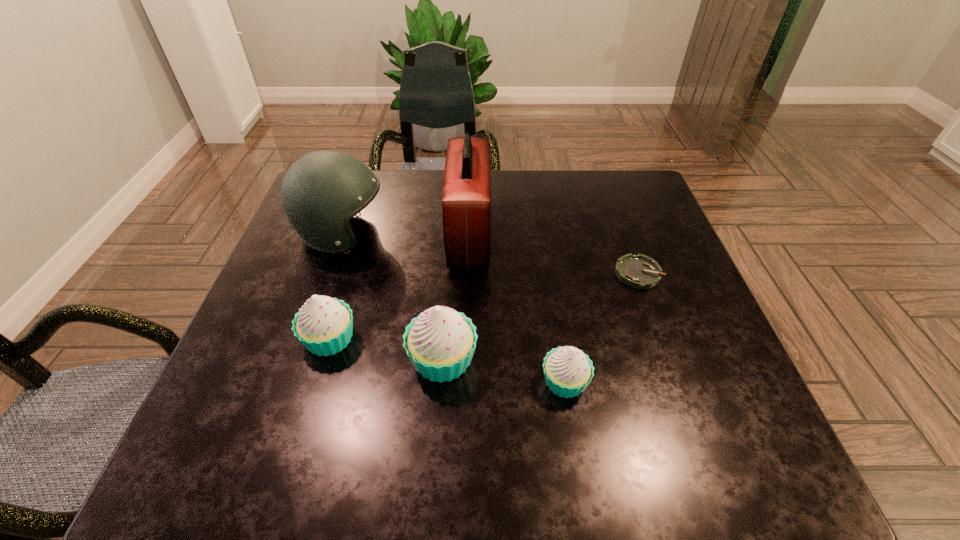
At what (x,y) coordinates should I click in order to perform the action: click on object positioned at the right edge. Please return your answer as a coordinate pair (x, y). This screenshot has height=540, width=960. Looking at the image, I should click on (639, 271).

Find the location of a particular element. The image size is (960, 540). object situated at the far left corner is located at coordinates (320, 193).

Identify the location of free spot at the far edge of the desktop. (530, 198).

What are the coordinates of `vacant area at the left edge` in the screenshot? It's located at (271, 349).

Find the location of a particular element. The height and width of the screenshot is (540, 960). vacant space at the right edge of the desktop is located at coordinates (702, 355).

This screenshot has width=960, height=540. Identify the location of vacant space at the far left corner. (351, 219).

Find the location of a particular element. Image resolution: width=960 pixels, height=540 pixels. free space at the far right corner of the desktop is located at coordinates (604, 198).

The height and width of the screenshot is (540, 960). In the image, there is a desktop. In order to click on vacant region at the near right corner in this screenshot , I will do `click(684, 404)`.

The image size is (960, 540). Find the location of `vacant area between the football helmet and the shortest object`. vacant area between the football helmet and the shortest object is located at coordinates (491, 254).

Find the location of a particular element. free area in between the ashtray and the football helmet is located at coordinates [x=491, y=254].